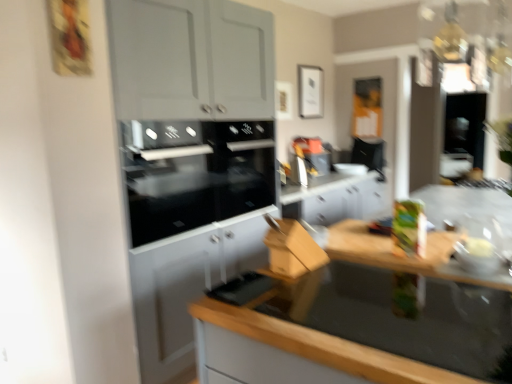
Question: Is wooden at lower right bigger or smaller than green matte box at right, which is the 2th appliance from right to left?

Choices:
 (A) big
 (B) small

Answer: (A)

Question: Is wooden at lower right situated inside green matte box at right, which is the 2th appliance from right to left, or outside?

Choices:
 (A) inside
 (B) outside

Answer: (B)

Question: Estimate the real-world distances between objects in this image. Which object is closer to the wooden at lower right?

Choices:
 (A) black glass oven at center, arranged as the third appliance when viewed from the right
 (B) green matte box at right, acting as the second appliance starting from the back
 (C) matte plastic bowl at right, marked as the first appliance in a front-to-back arrangement

Answer: (C)

Question: Estimate the real-world distances between objects in this image. Which object is closer to the wooden at lower right?

Choices:
 (A) black glass oven at center, which ranks as the first appliance in left-to-right order
 (B) green matte box at right, which is the 2th appliance from right to left
 (C) matte plastic bowl at right, marked as the first appliance in a front-to-back arrangement

Answer: (C)